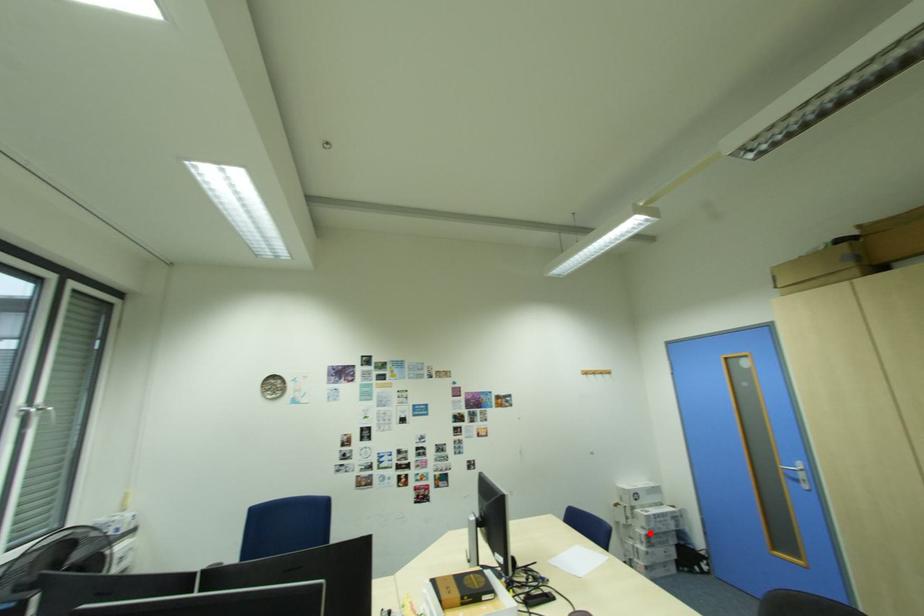
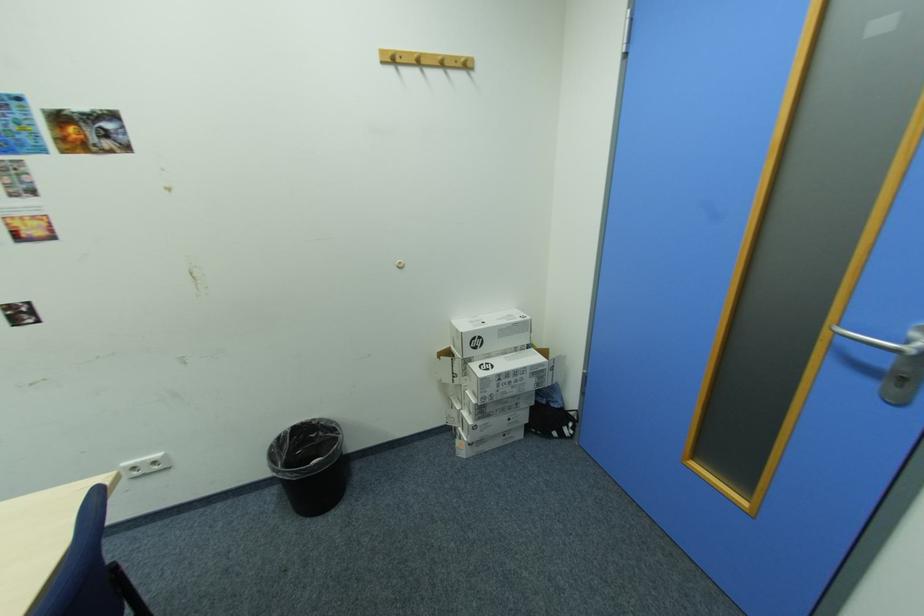
Question: I am providing you with two images of the same scene from different viewpoints. Image1 has a red point marked. In image2, the corresponding 3D location appears at what relative position? Reply with the corresponding letter.

Choices:
 (A) Closer
 (B) Farther

Answer: (B)